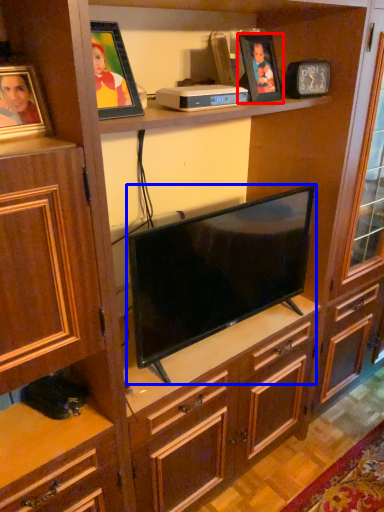
Question: Which object is further to the camera taking this photo, picture frame (highlighted by a red box) or television (highlighted by a blue box)?

Choices:
 (A) picture frame
 (B) television

Answer: (A)